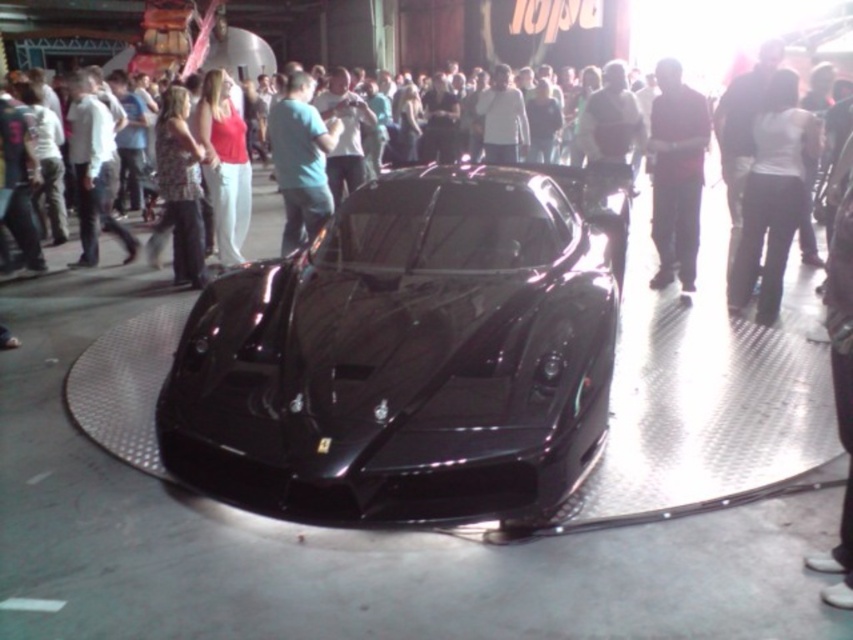
You are at the exhibition and want to take a photo of the Ferrari emblem on the car without anyone blocking your view. The dark red shirt at center is in your way. Where should you move to get an unobstructed view?

Move to the right or left of the dark red shirt at center to avoid obstruction. Since the dark red shirt at center is located at point (676, 173), moving laterally away from that position would provide a clearer view of the Ferrari emblem.

You are standing at point (x=305, y=188) and want to move to the Ferrari emblem near the grille of the black sports car. There is an obstacle at point (x=775, y=224). Can you walk directly to the Ferrari emblem without passing through the obstacle?

Point (x=775, y=224) is in front of point (x=305, y=188), so walking directly towards the Ferrari emblem would require passing through the obstacle at point (x=775, y=224).